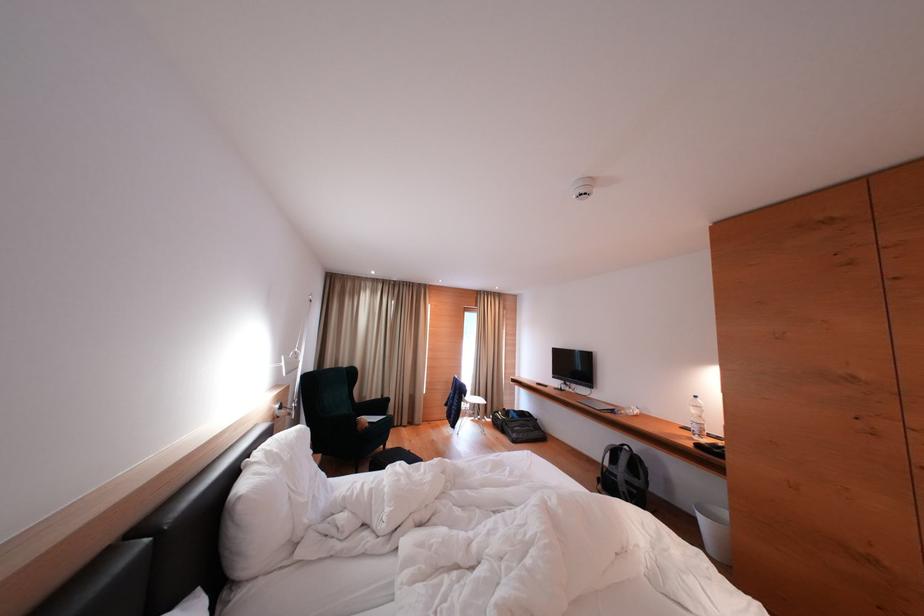
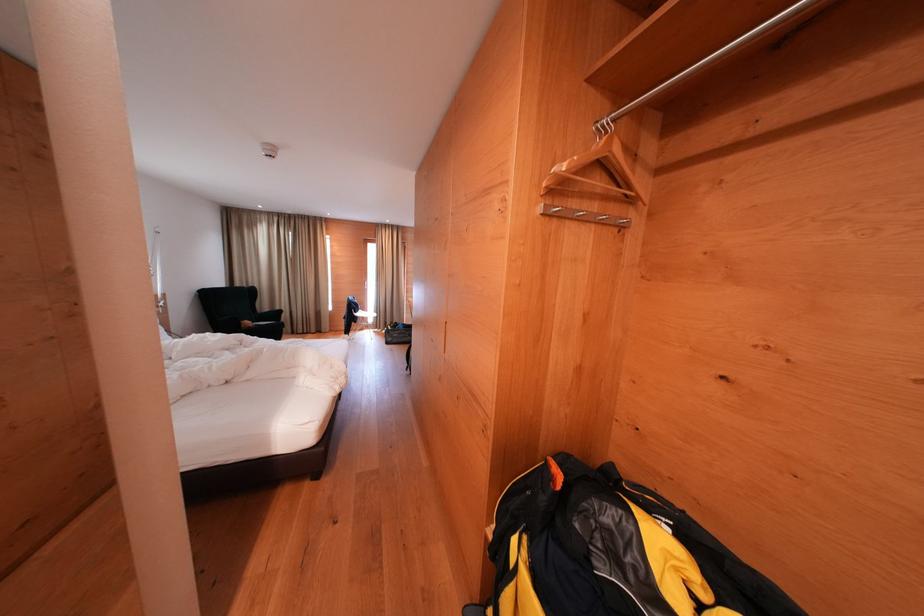
Locate, in the second image, the point that corresponds to (477,402) in the first image.

(374, 318)